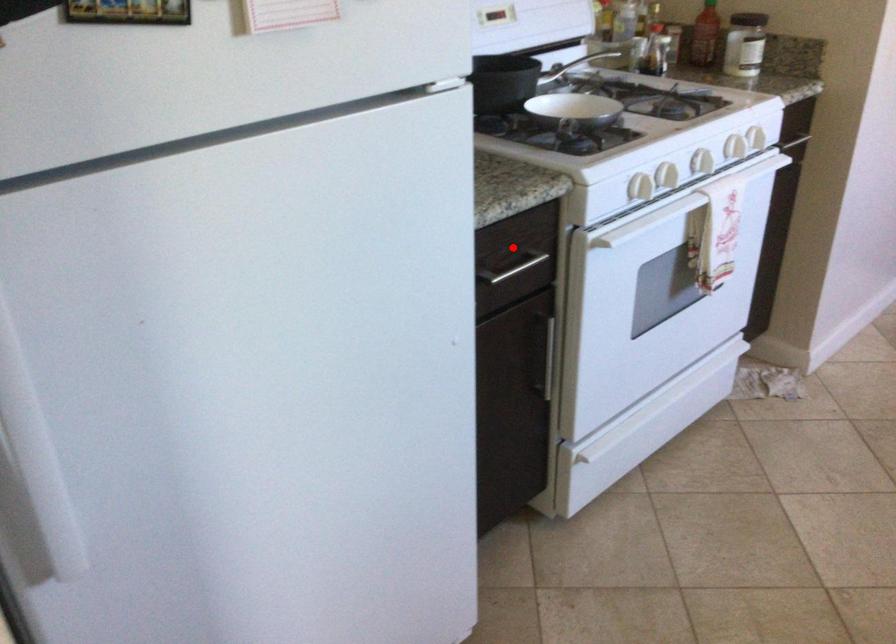
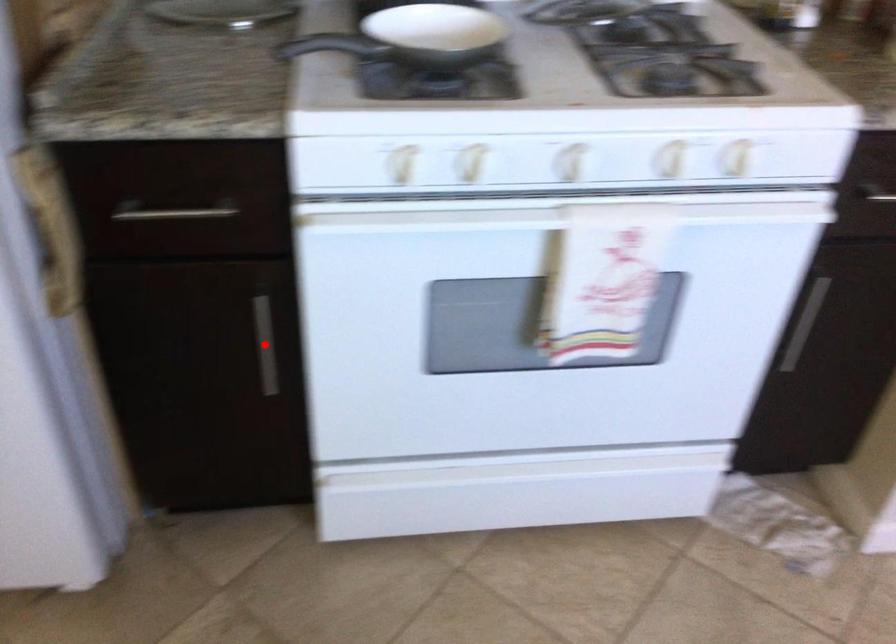
I am providing you with two images of the same scene from different viewpoints. A red point is marked on the first image and another point is marked on the second image. Are the points marked in image1 and image2 representing the same 3D position?

No